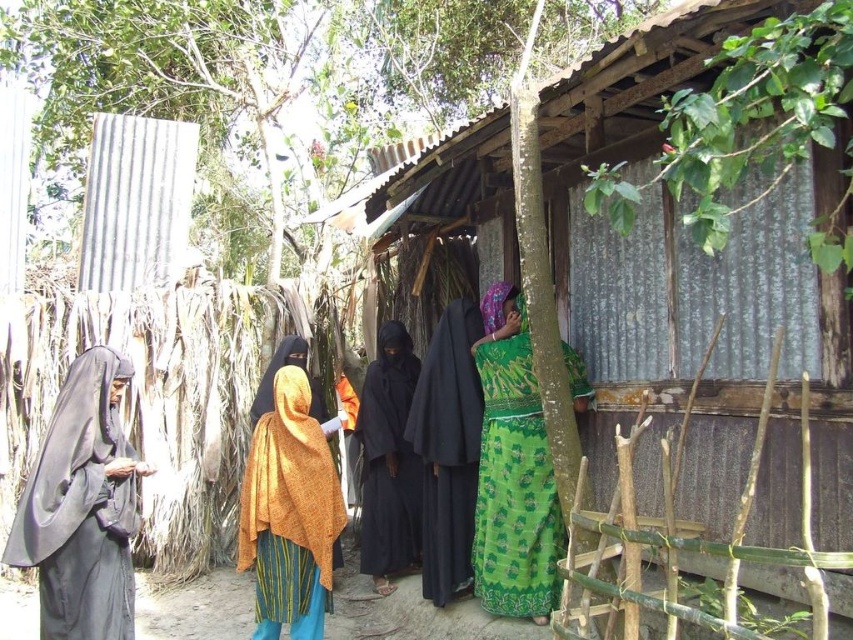
Does green printed dress at right appear over black matte robe at center?

Yes.

This screenshot has height=640, width=853. What do you see at coordinates (514, 472) in the screenshot?
I see `green printed dress at right` at bounding box center [514, 472].

Locate an element on the screen. The width and height of the screenshot is (853, 640). green printed dress at right is located at coordinates (514, 472).

Measure the distance from black matte robe at left to green printed dress at right.

black matte robe at left and green printed dress at right are 2.46 meters apart from each other.

Based on the photo, does black matte robe at left appear on the left side of green printed dress at right?

Indeed, black matte robe at left is positioned on the left side of green printed dress at right.

Where is `black matte robe at left`? This screenshot has height=640, width=853. black matte robe at left is located at coordinates (82, 508).

Where is `black matte robe at left`? This screenshot has height=640, width=853. black matte robe at left is located at coordinates (82, 508).

Is green printed dress at right above orange textured shawl at center?

Yes.

Who is more forward, (x=548, y=547) or (x=265, y=572)?

Point (x=265, y=572)

Does point (556, 552) come in front of point (299, 550)?

No, (556, 552) is behind (299, 550).

Locate an element on the screen. The image size is (853, 640). green printed dress at right is located at coordinates (514, 472).